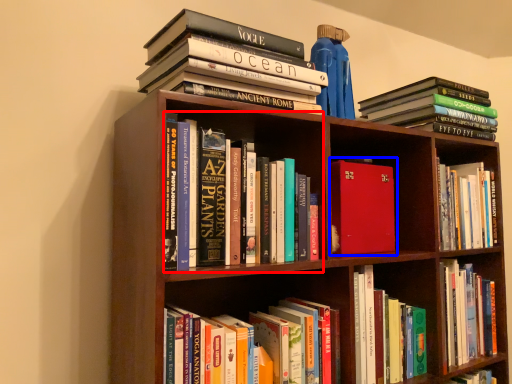
Question: Among these objects, which one is nearest to the camera, book (highlighted by a red box) or book (highlighted by a blue box)?

Choices:
 (A) book
 (B) book

Answer: (A)